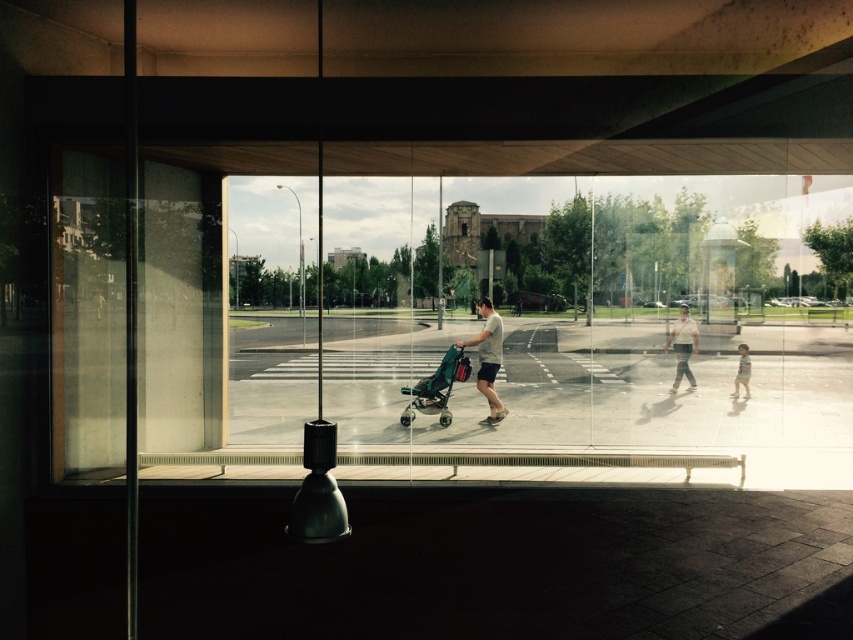
You are standing in a room and want to look outside through the transparent glass window at center. Where should you position yourself to see the entire window frame?

To see the entire transparent glass window at center, you should position yourself directly in front of the window at its central point, which is located at coordinates approximately 0.473 on the x and 0.583 on the y axis.

You are standing inside a building looking through a large glass window. You see a teal fabric stroller at center and a matte black skateboard at center outside. Which object is closer to you through the window?

The teal fabric stroller at center is closer to you because it is in front of the matte black skateboard at center.

You are standing inside a building and want to observe the teal fabric stroller at center through the transparent glass window at center. Can you see the stroller clearly through the window?

The transparent glass window at center is closer to the viewer than the teal fabric stroller at center, so yes, you can see the teal fabric stroller at center clearly through the window since the window is in front of it and not obstructing the view.